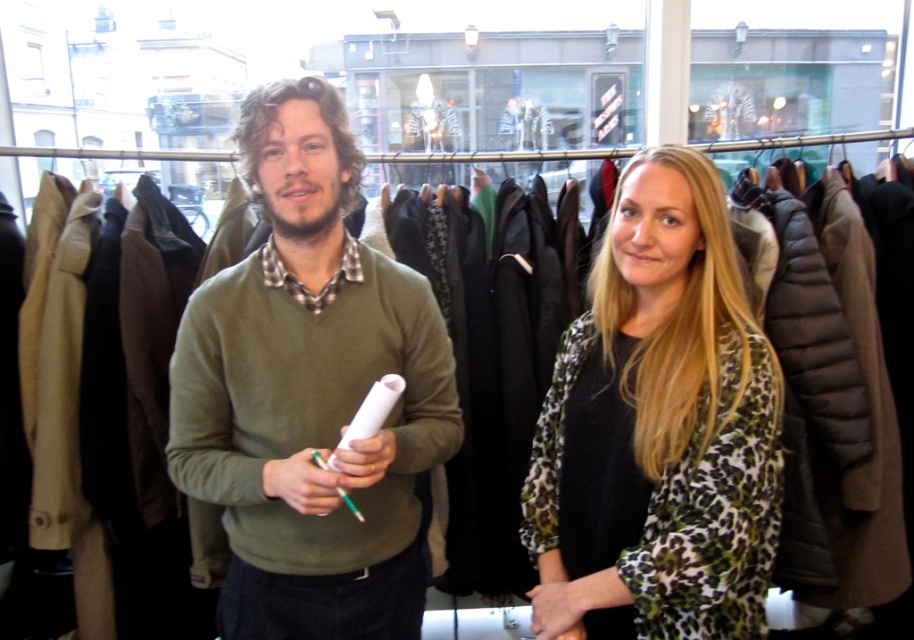
Question: Which point appears closest to the camera in this image?

Choices:
 (A) (689, 628)
 (B) (209, 468)

Answer: (B)

Question: Does green matte sweater at center appear under leopard print blouse at center?

Choices:
 (A) yes
 (B) no

Answer: (B)

Question: Which point appears farthest from the camera in this image?

Choices:
 (A) (651, 625)
 (B) (379, 298)

Answer: (B)

Question: Can you confirm if green matte sweater at center is wider than leopard print blouse at center?

Choices:
 (A) no
 (B) yes

Answer: (B)

Question: Is green matte sweater at center above leopard print blouse at center?

Choices:
 (A) no
 (B) yes

Answer: (B)